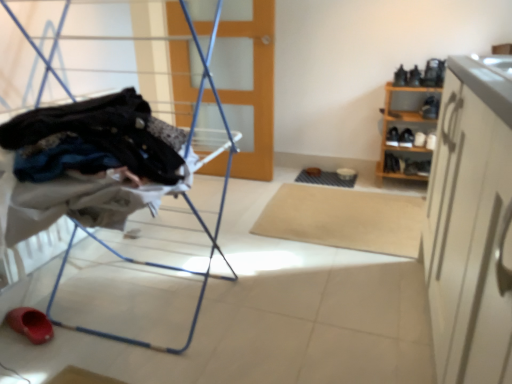
Locate an element on the screen. The width and height of the screenshot is (512, 384). free spot to the left of beige carpet at center is located at coordinates (212, 225).